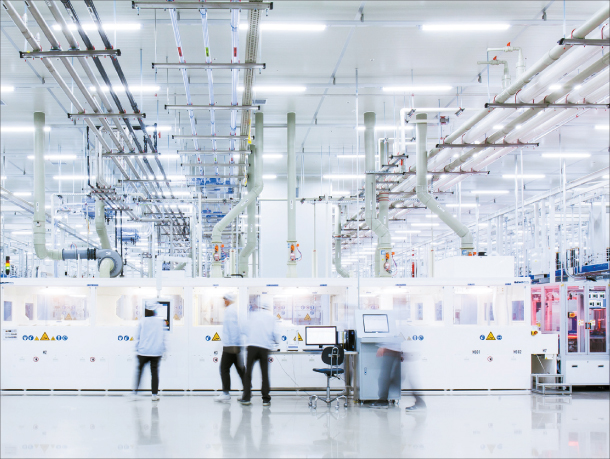
I want to click on floor, so click(x=315, y=432).